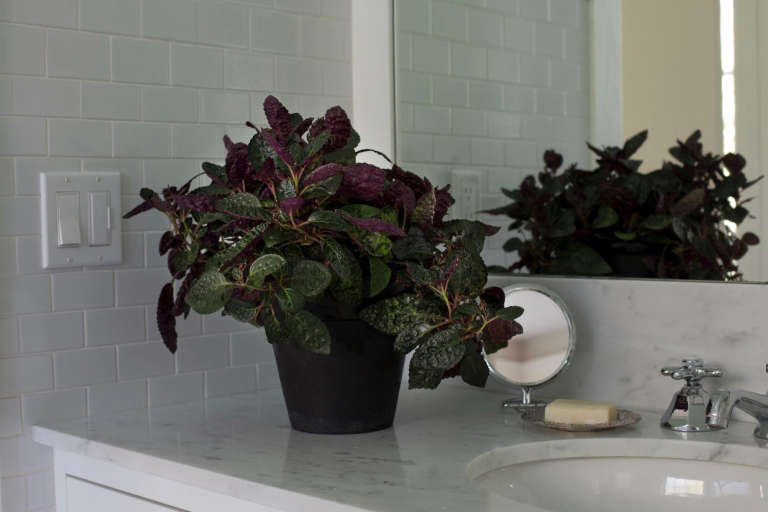
Identify the location of pot. This screenshot has width=768, height=512. (366, 391).